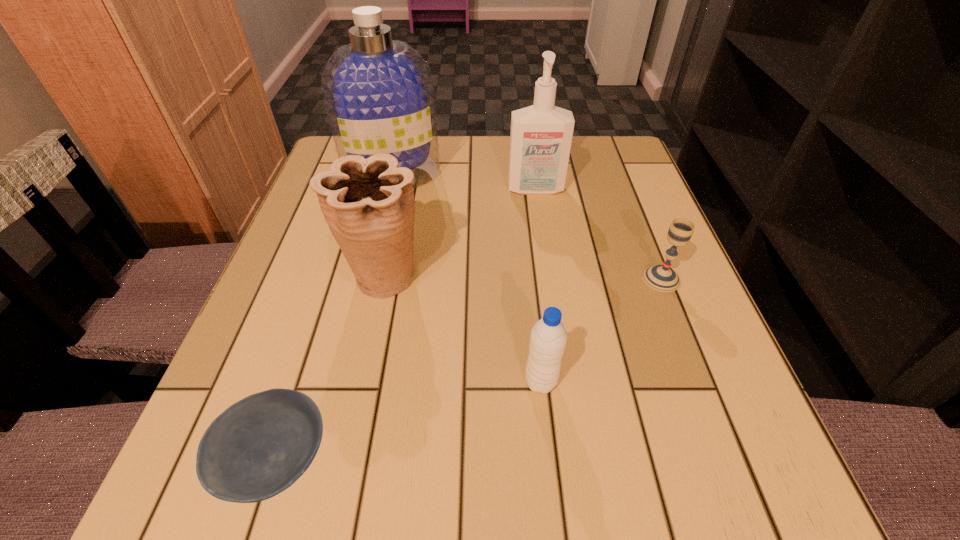
Locate an element on the screen. This screenshot has width=960, height=540. bowl is located at coordinates (258, 447).

This screenshot has height=540, width=960. I want to click on vacant space located 0.380m on the front of the taller cleansing agent, so click(x=354, y=328).

Identify the location of vacant space located 0.220m on the front label of the second tallest object. (547, 268).

You are a GUI agent. You are given a task and a screenshot of the screen. Output one action in this format:
    pyautogui.click(x=<x>, y=<y>)
    Task: Click on the vacant area located 0.050m on the left of the third tallest object
    
    Given the screenshot: What is the action you would take?
    pyautogui.click(x=314, y=276)

What are the coordinates of `vacant region located 0.210m on the back of the third shortest object` in the screenshot? It's located at (529, 273).

Where is `vacant space located 0.360m on the left of the second shortest object`? Image resolution: width=960 pixels, height=540 pixels. vacant space located 0.360m on the left of the second shortest object is located at coordinates (450, 279).

You are a GUI agent. You are given a task and a screenshot of the screen. Output one action in this format:
    pyautogui.click(x=<x>, y=<y>)
    Task: Click on the free location located 0.290m on the back of the bowl
    The width and height of the screenshot is (960, 540).
    Given the screenshot: What is the action you would take?
    pyautogui.click(x=337, y=269)

Where is `object located in the near edge section of the desktop`? The width and height of the screenshot is (960, 540). object located in the near edge section of the desktop is located at coordinates (258, 447).

Where is `cleansing agent positioned at the left edge`? Image resolution: width=960 pixels, height=540 pixels. cleansing agent positioned at the left edge is located at coordinates (378, 92).

You are a GUI agent. You are given a task and a screenshot of the screen. Output one action in this format:
    pyautogui.click(x=<x>, y=<y>)
    Task: Click on the urn located in the left edge section of the desktop
    
    Given the screenshot: What is the action you would take?
    pyautogui.click(x=368, y=204)